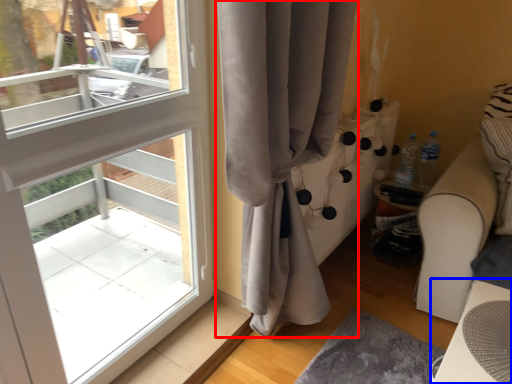
Question: Which object appears closest to the camera in this image, curtain (highlighted by a red box) or table (highlighted by a blue box)?

Choices:
 (A) curtain
 (B) table

Answer: (A)